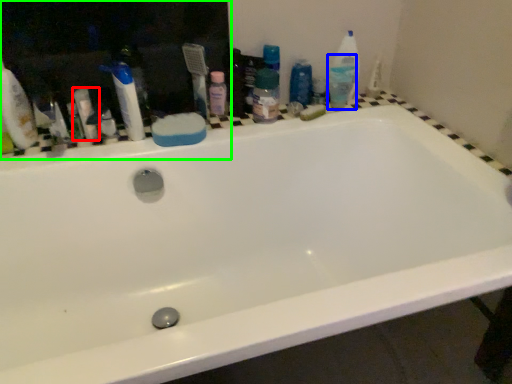
Question: Considering the real-world distances, which object is closest to toiletry (highlighted by a red box)? toiletry (highlighted by a blue box) or medicine cabinet (highlighted by a green box).

Choices:
 (A) toiletry
 (B) medicine cabinet

Answer: (B)